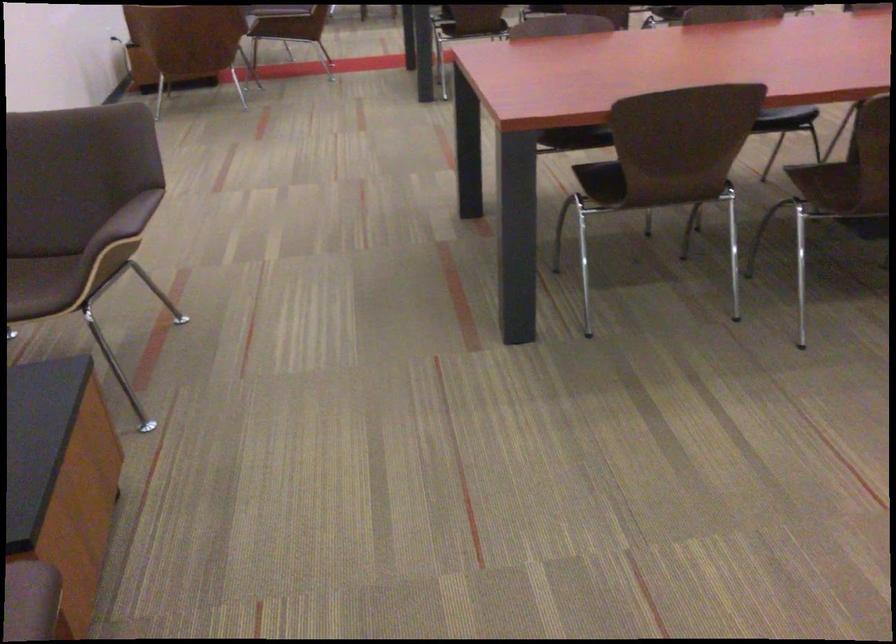
The image size is (896, 644). Describe the element at coordinates (133, 216) in the screenshot. I see `the brown chair armrest` at that location.